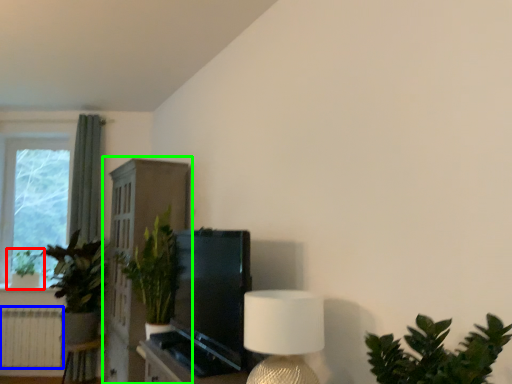
Question: Which object is the closest to the houseplant (highlighted by a red box)? Choose among these: radiator (highlighted by a blue box) or dresser (highlighted by a green box).

Choices:
 (A) radiator
 (B) dresser

Answer: (A)